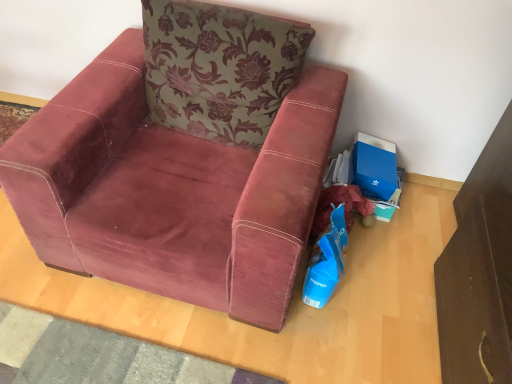
Question: Is blue plastic shopping bag at lower right not inside velvet maroon armchair at center?

Choices:
 (A) no
 (B) yes

Answer: (B)

Question: Considering the relative positions of blue plastic shopping bag at lower right and velvet maroon armchair at center in the image provided, is blue plastic shopping bag at lower right to the left of velvet maroon armchair at center from the viewer's perspective?

Choices:
 (A) yes
 (B) no

Answer: (B)

Question: Is blue plastic shopping bag at lower right oriented towards velvet maroon armchair at center?

Choices:
 (A) no
 (B) yes

Answer: (A)

Question: From a real-world perspective, is blue plastic shopping bag at lower right on velvet maroon armchair at center?

Choices:
 (A) yes
 (B) no

Answer: (B)

Question: Considering the relative sizes of blue plastic shopping bag at lower right and velvet maroon armchair at center in the image provided, is blue plastic shopping bag at lower right thinner than velvet maroon armchair at center?

Choices:
 (A) yes
 (B) no

Answer: (A)

Question: Considering their positions, is blue cardboard box at lower right located in front of or behind blue plastic shopping bag at lower right?

Choices:
 (A) behind
 (B) front

Answer: (A)

Question: Is blue cardboard box at lower right spatially inside blue plastic shopping bag at lower right, or outside of it?

Choices:
 (A) outside
 (B) inside

Answer: (A)

Question: From their relative heights in the image, would you say blue cardboard box at lower right is taller or shorter than blue plastic shopping bag at lower right?

Choices:
 (A) short
 (B) tall

Answer: (A)

Question: Considering the positions of point (354, 177) and point (333, 243), is point (354, 177) closer or farther from the camera than point (333, 243)?

Choices:
 (A) farther
 (B) closer

Answer: (A)

Question: From the image's perspective, is blue plastic shopping bag at lower right above or below green floral fabric pillow at upper center?

Choices:
 (A) above
 (B) below

Answer: (B)

Question: Based on their sizes in the image, would you say blue plastic shopping bag at lower right is bigger or smaller than green floral fabric pillow at upper center?

Choices:
 (A) big
 (B) small

Answer: (B)

Question: Does point (311, 279) appear closer or farther from the camera than point (231, 140)?

Choices:
 (A) farther
 (B) closer

Answer: (B)

Question: Is blue plastic shopping bag at lower right to the left or to the right of green floral fabric pillow at upper center in the image?

Choices:
 (A) left
 (B) right

Answer: (B)

Question: Based on their positions, is blue cardboard box at lower right located to the left or right of green floral fabric pillow at upper center?

Choices:
 (A) left
 (B) right

Answer: (B)

Question: In terms of width, does blue cardboard box at lower right look wider or thinner when compared to green floral fabric pillow at upper center?

Choices:
 (A) thin
 (B) wide

Answer: (A)